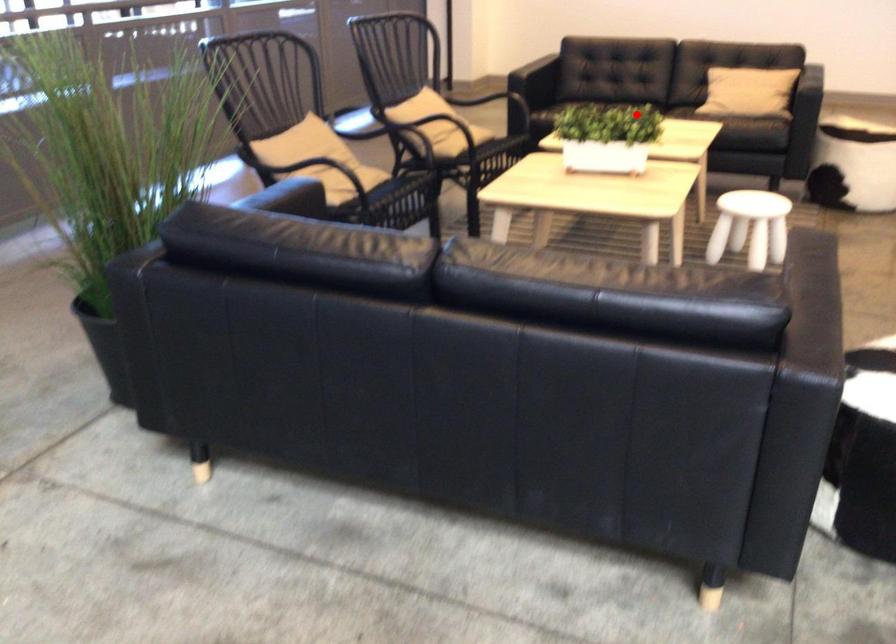
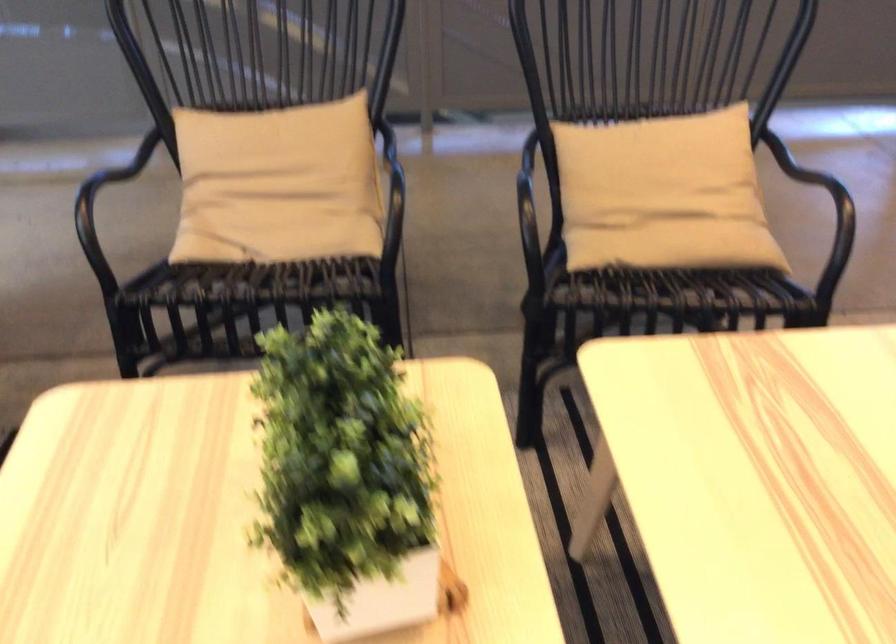
Locate, in the second image, the point that corresponds to the highlighted location in the first image.

(346, 477)